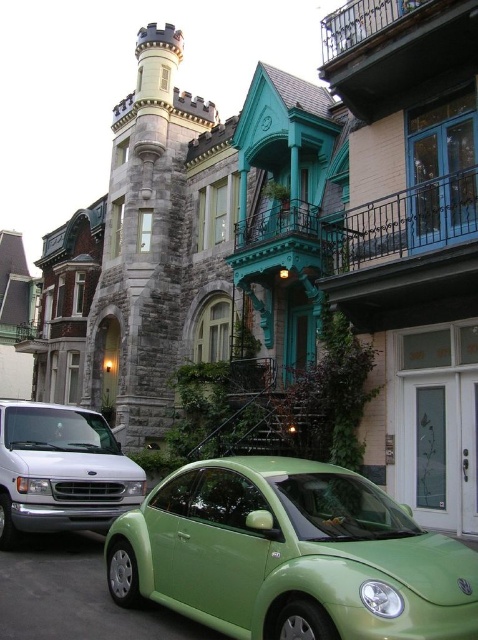
You are a delivery driver who needs to park your vehicle in this street scene. You have a truck that is the same size as the silver metallic van at lower left. There is a parking spot next to the green matte car at lower center. Will your truck fit in the parking spot if the car is already there?

The green matte car at lower center is larger in size than the silver metallic van at lower left. Since your truck is the same size as the van, it should fit in the parking spot next to the car as long as the space allocated is standard. However, the exact fit may depend on the specific dimensions of the parking spot and the car.

You are a pedestrian standing on the sidewalk and want to cross the street to reach the silver metallic van at lower left. Is the green matte car at lower center blocking your path?

The green matte car at lower center is in front of the silver metallic van at lower left, so it is blocking the path to the van. You would need to go around the green matte car at lower center to reach the silver metallic van at lower left.

You are a delivery person standing at the sidewalk in front of the green matte car at lower center. You need to deliver a package to the silver metallic van at lower left. The van is parked behind a barrier that requires a minimum distance of 50 feet to safely navigate around. Can you safely deliver the package without moving the barrier?

The green matte car at lower center is 42.99 feet away from the silver metallic van at lower left. Since the required minimum distance to navigate around the barrier is 50 feet and the actual distance between them is less than that, you cannot safely deliver the package without moving the barrier.